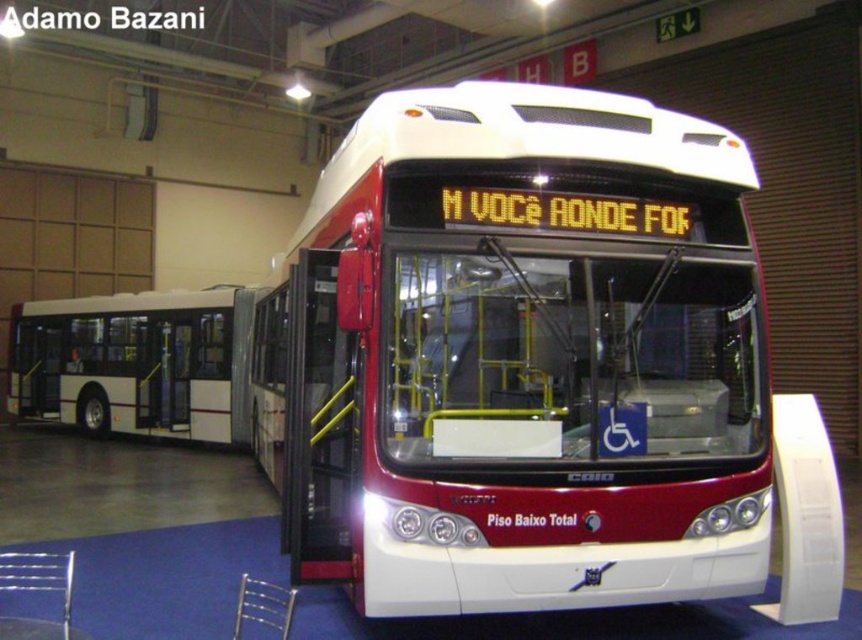
Does matte white bus at center lie in front of white matte bus at left?

Yes, matte white bus at center is closer to the viewer.

Between matte white bus at center and white matte bus at left, which one has less height?

matte white bus at center is shorter.

Is point (476, 380) positioned after point (122, 364)?

No, it is not.

Where is `matte white bus at center`? The height and width of the screenshot is (640, 862). matte white bus at center is located at coordinates (523, 356).